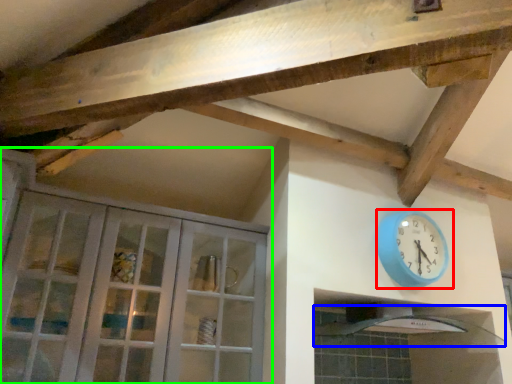
Question: Which object is positioned farthest from wall clock (highlighted by a red box)? Select from exhaust hood (highlighted by a blue box) and cabinetry (highlighted by a green box).

Choices:
 (A) exhaust hood
 (B) cabinetry

Answer: (B)